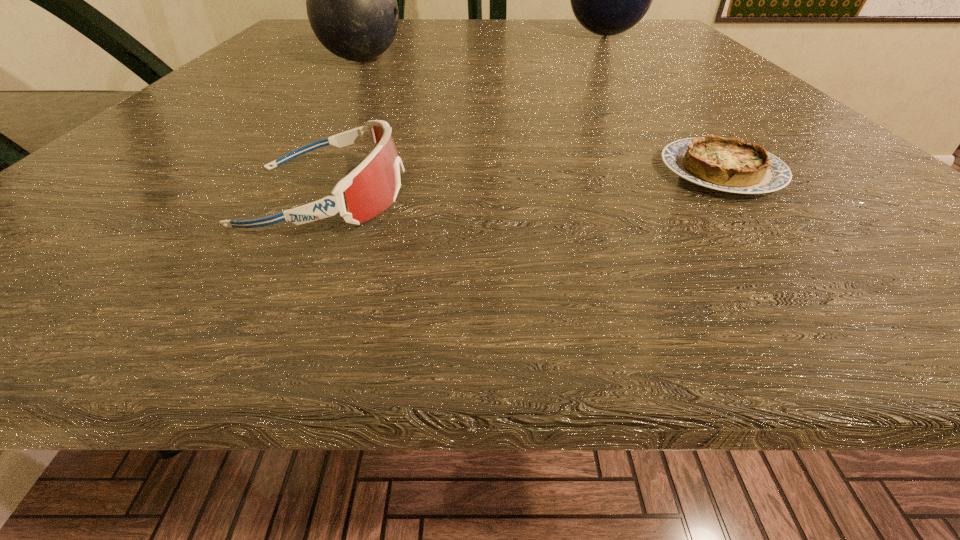
Identify the location of the farthest object. (607, 0).

I want to click on the farther bowling ball, so click(607, 0).

You are a GUI agent. You are given a task and a screenshot of the screen. Output one action in this format:
    pyautogui.click(x=<x>, y=<y>)
    Task: Click on the third nearest object
    The image size is (960, 540).
    Given the screenshot: What is the action you would take?
    pyautogui.click(x=351, y=0)

Locate an element on the screen. the left bowling ball is located at coordinates (351, 0).

Locate an element on the screen. goggles is located at coordinates (373, 185).

The image size is (960, 540). I want to click on the shortest object, so click(730, 165).

Find the location of a particular element. Image resolution: width=960 pixels, height=540 pixels. free space located on the surface of the farther bowling ball near the finger holes is located at coordinates (467, 35).

Identify the location of free space located on the surface of the farther bowling ball near the finger holes. (457, 35).

Find the location of a particular element. free space located 0.260m on the surface of the farther bowling ball near the finger holes is located at coordinates (437, 35).

Where is `blank space located on the grip area of the left bowling ball`? This screenshot has width=960, height=540. blank space located on the grip area of the left bowling ball is located at coordinates (595, 60).